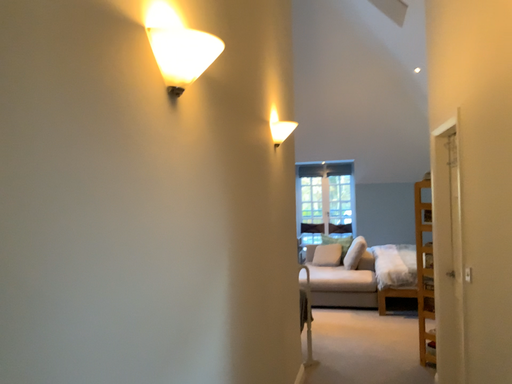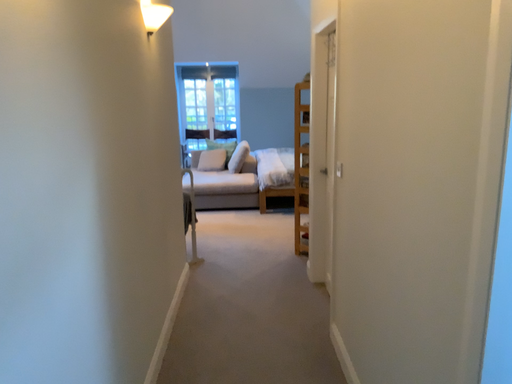
Question: How did the camera likely rotate when shooting the video?

Choices:
 (A) rotated downward
 (B) rotated upward

Answer: (A)